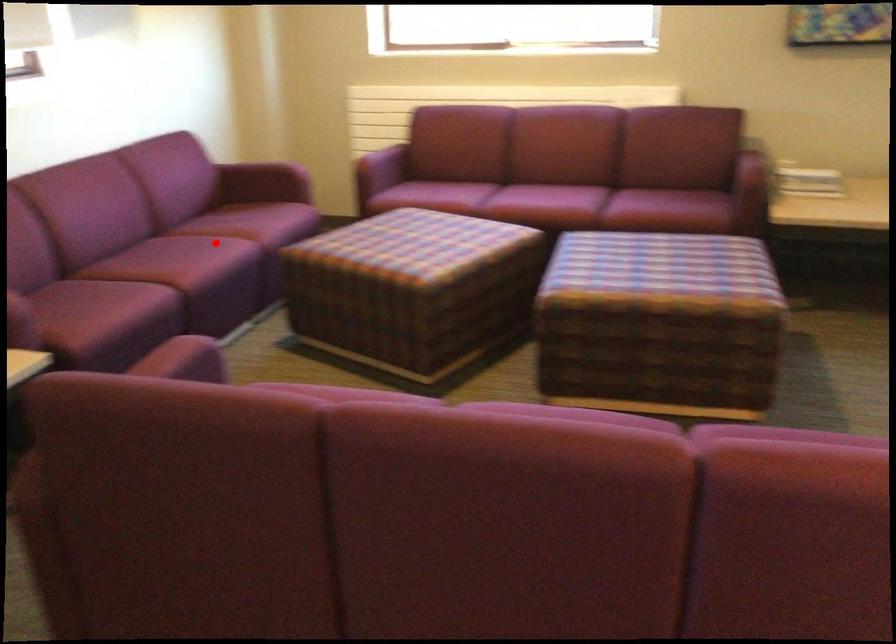
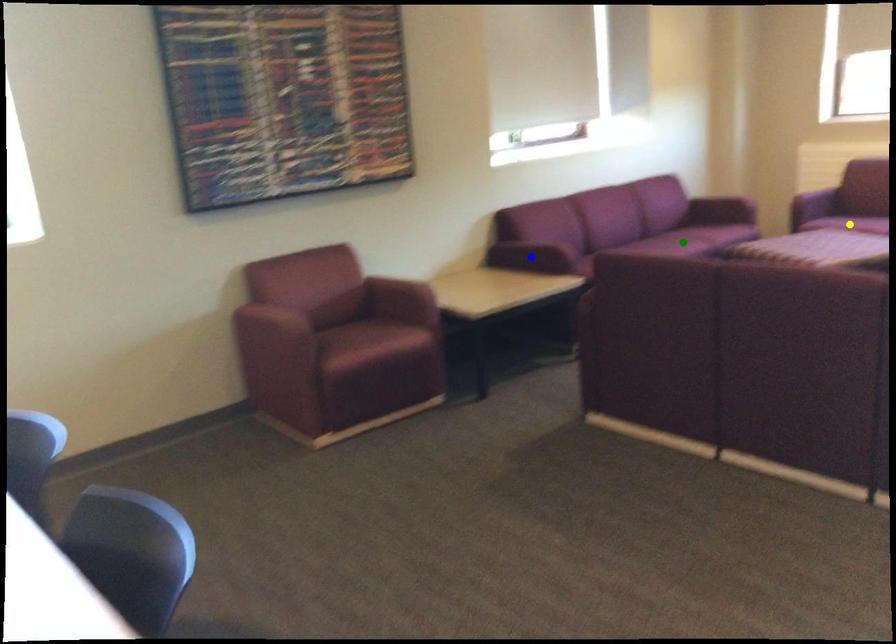
Question: I am providing you with two images of the same scene from different viewpoints. A red point is marked on the first image. You are given multiple points on the second image. Can you choose the point in image 2 that corresponds to the point in image 1?

Choices:
 (A) green point
 (B) blue point
 (C) yellow point

Answer: (A)